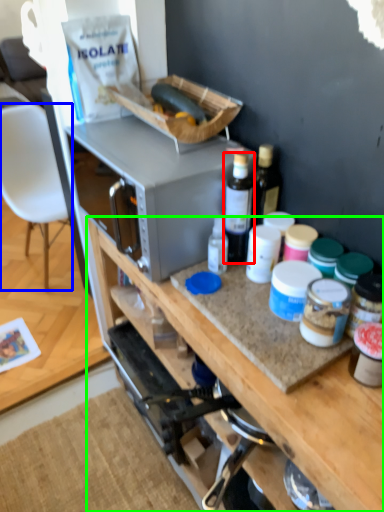
Question: Which object is the closest to the bottle (highlighted by a red box)? Choose among these: chair (highlighted by a blue box) or cabinetry (highlighted by a green box).

Choices:
 (A) chair
 (B) cabinetry

Answer: (B)